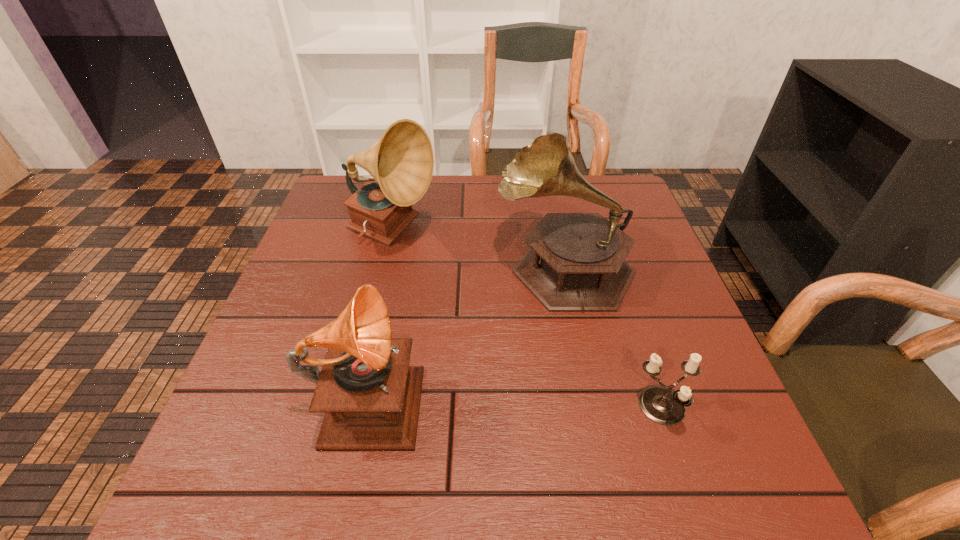
You are a GUI agent. You are given a task and a screenshot of the screen. Output one action in this format:
    pyautogui.click(x=<x>, y=<y>)
    Task: Click on the candle holder that is at the right edge
    This screenshot has width=960, height=540.
    Given the screenshot: What is the action you would take?
    pyautogui.click(x=659, y=403)

Image resolution: width=960 pixels, height=540 pixels. What are the coordinates of `object at the far left corner` in the screenshot? It's located at (401, 162).

Locate an element on the screen. vacant space at the far edge of the desktop is located at coordinates (471, 203).

I want to click on free space at the near edge, so click(x=572, y=489).

Locate an element on the screen. The height and width of the screenshot is (540, 960). vacant space at the left edge of the desktop is located at coordinates (253, 368).

Image resolution: width=960 pixels, height=540 pixels. In the image, there is a desktop. Find the location of `vacant region at the right edge`. vacant region at the right edge is located at coordinates point(650,380).

You are a GUI agent. You are given a task and a screenshot of the screen. Output one action in this format:
    pyautogui.click(x=<x>, y=<y>)
    Task: Click on the vacant area that lies between the nearest phonograph record and the rightmost phonograph record
    
    Given the screenshot: What is the action you would take?
    click(x=467, y=329)

The width and height of the screenshot is (960, 540). In order to click on free space between the candle holder and the nearest phonograph record in this screenshot , I will do `click(516, 400)`.

Locate an element on the screen. This screenshot has height=540, width=960. free space that is in between the candle holder and the rightmost phonograph record is located at coordinates (613, 337).

Identify the location of free point between the nearest phonograph record and the candle holder. This screenshot has height=540, width=960. (516, 400).